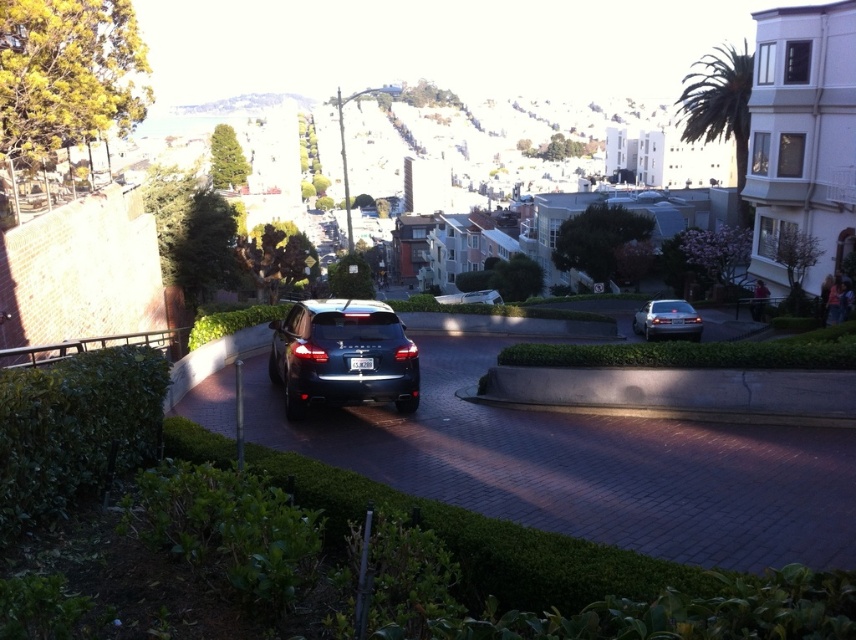
You are a delivery driver who needs to park your vehicle in a space that can only accommodate cars narrower than the white plastic license plate at center. Can the satin black sedan at center fit in this space?

The satin black sedan at center is wider than the white plastic license plate at center, so it cannot fit in a space that requires cars narrower than the license plate.

You are a delivery driver trying to read the license plate of the satin black sedan at center from your current position. Based on the scene, can you see the white plastic license plate at center clearly?

The satin black sedan at center is below the white plastic license plate at center, so yes, you can see the white plastic license plate at center clearly from your current position.

Looking at this image, you are a delivery driver who needs to park your car between the two sedans shown in the image. The satin black sedan at center and the satin silver sedan at center. Which sedan should you park behind to ensure your vehicle is positioned higher up the slope?

You should park behind the satin silver sedan at center because the satin black sedan at center is below it, indicating the silver sedan is higher up the slope.